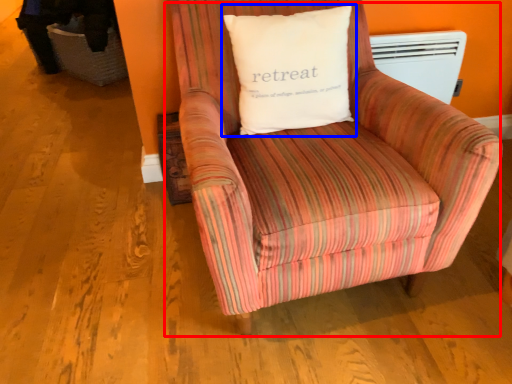
Question: Which of the following is the closest to the observer, chair (highlighted by a red box) or pillow (highlighted by a blue box)?

Choices:
 (A) chair
 (B) pillow

Answer: (A)